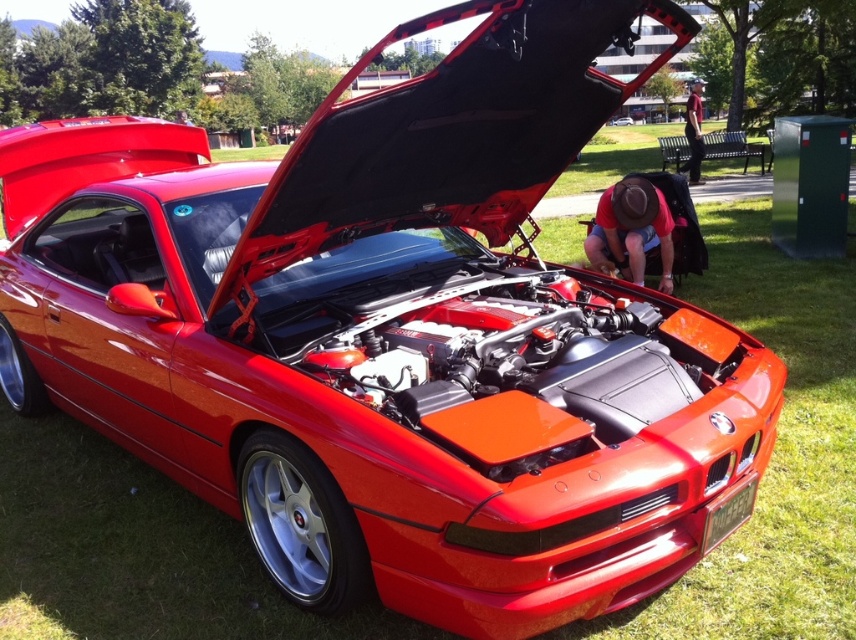
Question: Does red cotton shirt at center have a smaller size compared to maroon fabric shirt at upper right?

Choices:
 (A) no
 (B) yes

Answer: (B)

Question: Which point appears closest to the camera in this image?

Choices:
 (A) (694, 125)
 (B) (623, 202)

Answer: (B)

Question: Among these objects, which one is nearest to the camera?

Choices:
 (A) red cotton shirt at center
 (B) maroon fabric shirt at upper right

Answer: (A)

Question: Is red cotton shirt at center wider than maroon fabric shirt at upper right?

Choices:
 (A) no
 (B) yes

Answer: (A)

Question: Can you confirm if red cotton shirt at center is positioned to the left of maroon fabric shirt at upper right?

Choices:
 (A) yes
 (B) no

Answer: (A)